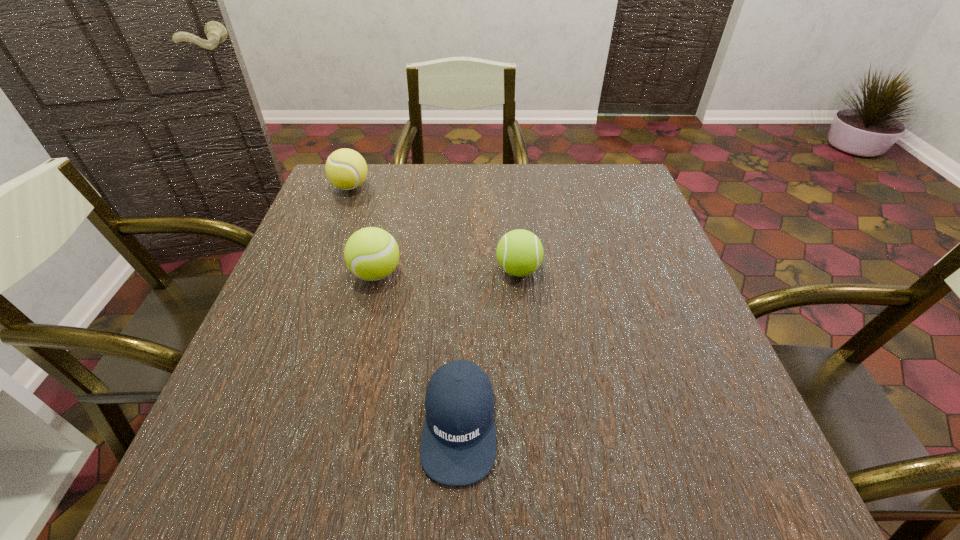
Select which tennis ball appears as the third closest to the shortest object. Please provide its 2D coordinates. Your answer should be formatted as a tuple, i.e. [(x, y)], where the tuple contains the x and y coordinates of a point satisfying the conditions above.

[(346, 169)]

You are a GUI agent. You are given a task and a screenshot of the screen. Output one action in this format:
    pyautogui.click(x=<x>, y=<y>)
    Task: Click on the vacant space that satisfies the following two spatial constraints: 1. on the front side of the farthest object; 2. on the left side of the rightmost object
    
    Given the screenshot: What is the action you would take?
    pyautogui.click(x=319, y=270)